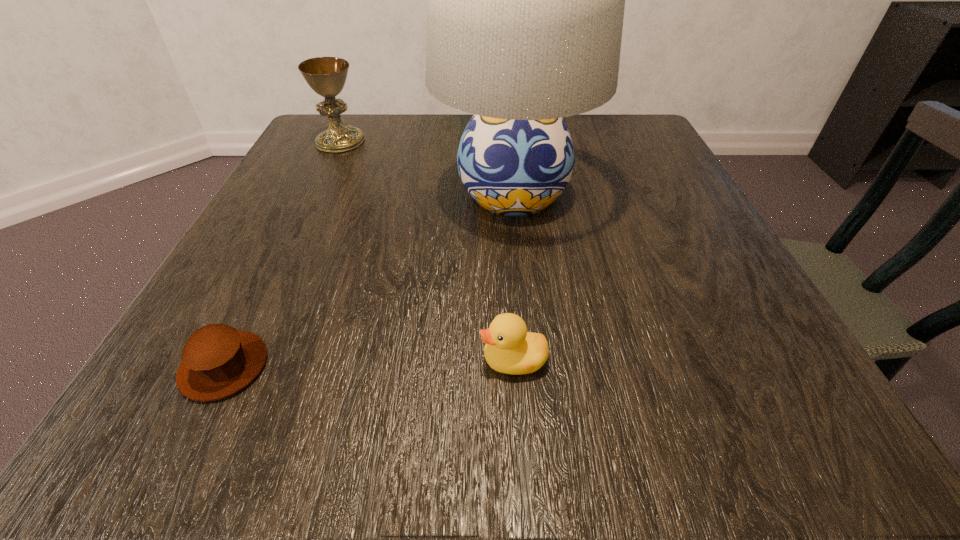
Locate an element on the screen. The width and height of the screenshot is (960, 540). vacant space located on the face of the duckling is located at coordinates (307, 360).

Identify the location of vacant region located 0.400m on the right of the muffin. The width and height of the screenshot is (960, 540). click(598, 366).

Find the location of a particular element. The image size is (960, 540). lampshade at the far edge is located at coordinates (525, 0).

Identify the location of chalice positioned at the far edge. This screenshot has width=960, height=540. (327, 76).

You are a GUI agent. You are given a task and a screenshot of the screen. Output one action in this format:
    pyautogui.click(x=<x>, y=<y>)
    Task: Click on the duckling located at the near edge
    
    Given the screenshot: What is the action you would take?
    pyautogui.click(x=509, y=348)

At what (x,y) coordinates should I click in order to perform the action: click on muffin located in the near edge section of the desktop. Please return your answer as a coordinate pair (x, y). The width and height of the screenshot is (960, 540). Looking at the image, I should click on (218, 360).

Where is `chalice located in the left edge section of the desktop`? chalice located in the left edge section of the desktop is located at coordinates (327, 76).

Identify the location of muffin situated at the left edge. (218, 360).

Where is `object that is at the far left corner`? object that is at the far left corner is located at coordinates click(x=327, y=76).

You are a GUI agent. You are given a task and a screenshot of the screen. Output one action in this format:
    pyautogui.click(x=<x>, y=<y>)
    Task: Click on the object that is at the near left corner
    
    Given the screenshot: What is the action you would take?
    pyautogui.click(x=218, y=360)